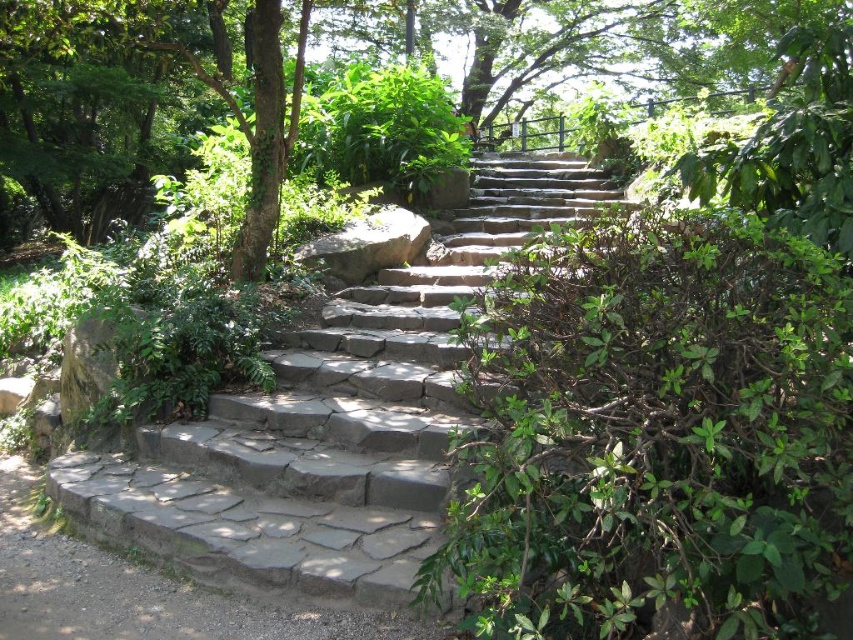
Is gray stone stairs at center shorter than gray stone steps at lower left?

Yes, gray stone stairs at center is shorter than gray stone steps at lower left.

Which of these two, gray stone stairs at center or gray stone steps at lower left, stands shorter?

Standing shorter between the two is gray stone stairs at center.

Between point (62, 508) and point (115, 628), which one is positioned in front?

Point (115, 628) is in front.

The height and width of the screenshot is (640, 853). Identify the location of gray stone stairs at center. (331, 420).

Which of these two, gray stone steps at lower left or gray rough rock at center, stands taller?

With more height is gray rough rock at center.

From the picture: Is gray stone steps at lower left taller than gray rough rock at center?

In fact, gray stone steps at lower left may be shorter than gray rough rock at center.

Is point (51, 573) farther from viewer compared to point (309, 260)?

No.

Where is `gray stone steps at lower left`? This screenshot has width=853, height=640. gray stone steps at lower left is located at coordinates (148, 589).

Can you confirm if gray stone stairs at center is positioned to the left of gray rough rock at center?

Incorrect, gray stone stairs at center is not on the left side of gray rough rock at center.

Which is more to the right, gray stone stairs at center or gray rough rock at center?

gray stone stairs at center

Find the location of a particular element. The image size is (853, 640). gray stone stairs at center is located at coordinates (331, 420).